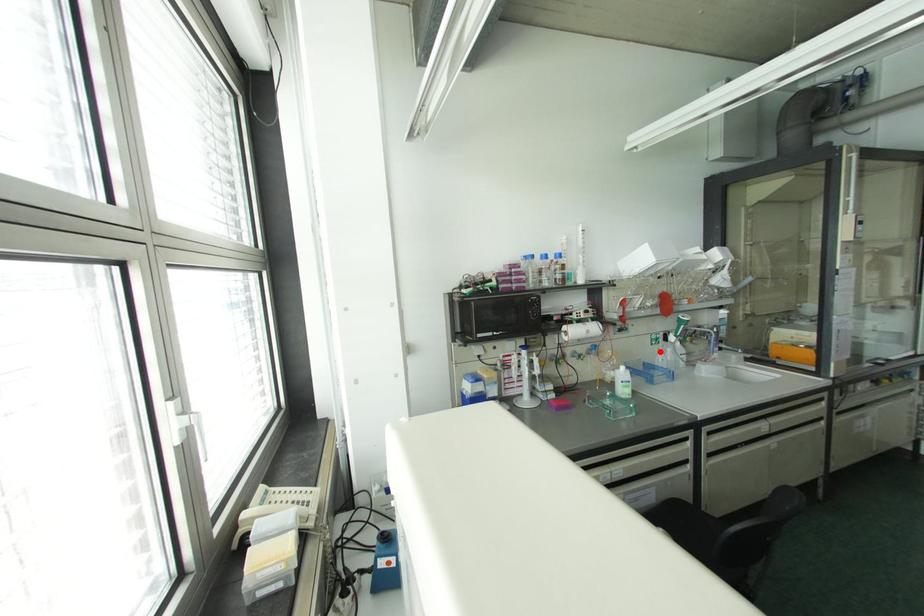
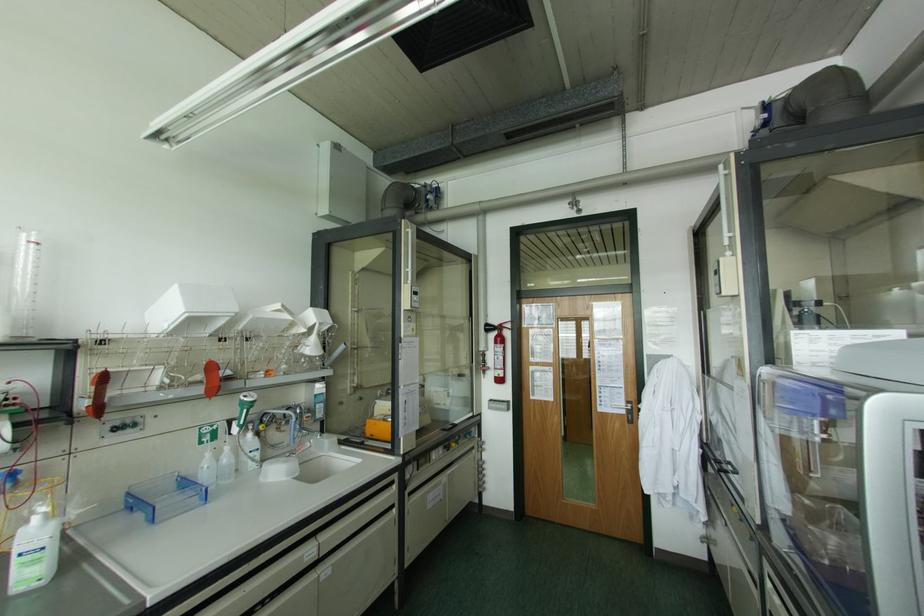
Question: A red point is marked in image1. In image2, is the corresponding 3D point closer to the camera or farther? Reply with the corresponding letter.

Choices:
 (A) The corresponding 3D point is closer.
 (B) The corresponding 3D point is farther.

Answer: (A)